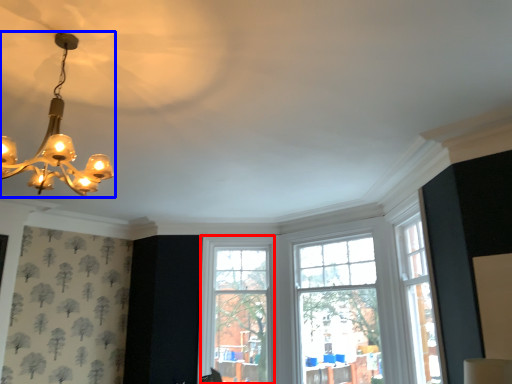
Question: Among these objects, which one is farthest to the camera, window (highlighted by a red box) or lamp (highlighted by a blue box)?

Choices:
 (A) window
 (B) lamp

Answer: (A)